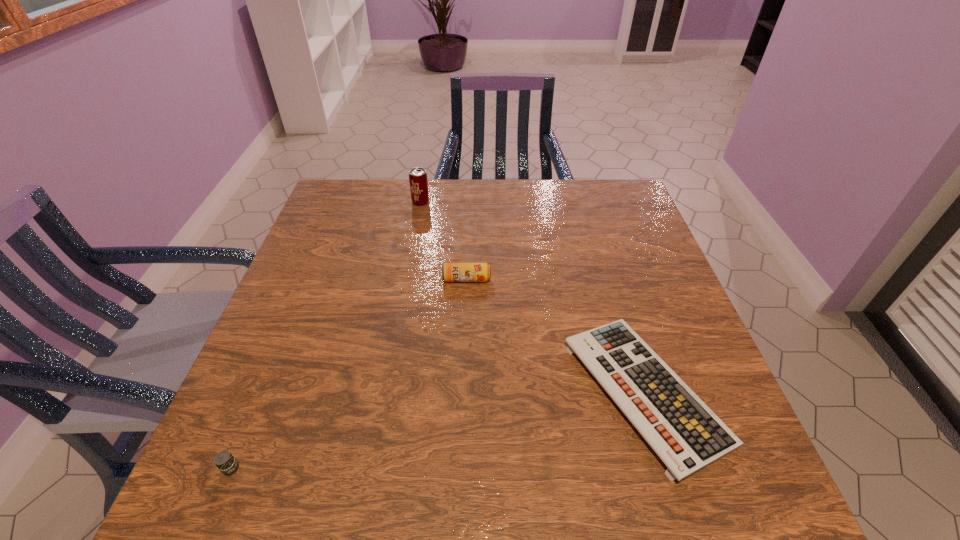
This screenshot has width=960, height=540. What are the coordinates of `free space between the third object from right to left and the second farthest beer can` in the screenshot? It's located at (444, 241).

At what (x,y) coordinates should I click in order to perform the action: click on free space between the shortest object and the second farthest object. Please return your answer as a coordinate pair (x, y). This screenshot has height=540, width=960. Looking at the image, I should click on (556, 335).

You are a GUI agent. You are given a task and a screenshot of the screen. Output one action in this format:
    pyautogui.click(x=<x>, y=<y>)
    Task: Click on the free space between the shortest object and the second farthest object
    This screenshot has height=540, width=960.
    Given the screenshot: What is the action you would take?
    pyautogui.click(x=556, y=335)

The width and height of the screenshot is (960, 540). Identify the location of vacant space that's between the tallest object and the computer keyboard. (533, 297).

The image size is (960, 540). I want to click on empty space between the rightmost beer can and the third object from right to left, so click(444, 241).

Where is `free space between the computer keyboard and the second beer can from right to left`? This screenshot has height=540, width=960. free space between the computer keyboard and the second beer can from right to left is located at coordinates (533, 297).

Select which object appears as the third closest to the shortest object. Please provide its 2D coordinates. Your answer should be formatted as a tuple, i.e. [(x, y)], where the tuple contains the x and y coordinates of a point satisfying the conditions above.

[(227, 464)]

Where is `the third closest object to the farthest object`? This screenshot has width=960, height=540. the third closest object to the farthest object is located at coordinates (227, 464).

This screenshot has height=540, width=960. What are the coordinates of `the third closest beer can to the shortest object` in the screenshot? It's located at (227, 464).

At what (x,y) coordinates should I click in order to perform the action: click on beer can that is the second closest to the third object from right to left. Please return your answer as a coordinate pair (x, y). The height and width of the screenshot is (540, 960). Looking at the image, I should click on (227, 464).